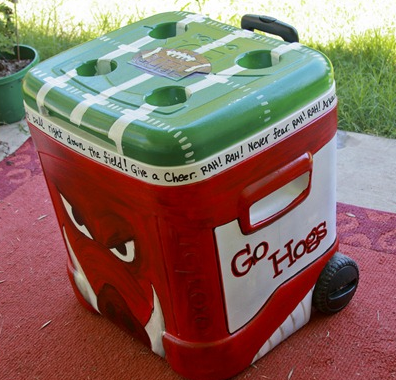
Where is `hog painting`? This screenshot has width=396, height=380. hog painting is located at coordinates (128, 257).